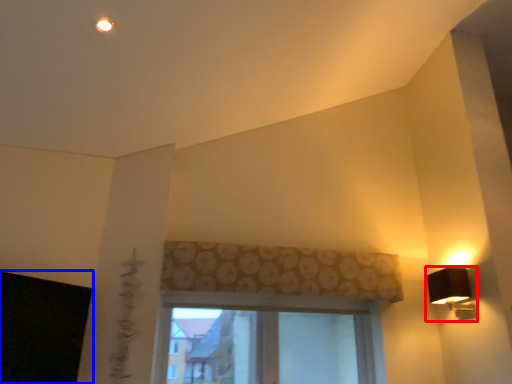
Question: Which of the following is the farthest to the observer, lamp (highlighted by a red box) or window screen (highlighted by a blue box)?

Choices:
 (A) lamp
 (B) window screen

Answer: (A)